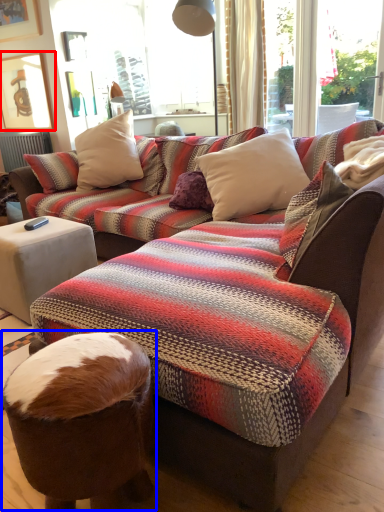
Question: Which of the following is the closest to the observer, picture frame (highlighted by a red box) or bean bag chair (highlighted by a blue box)?

Choices:
 (A) picture frame
 (B) bean bag chair

Answer: (B)